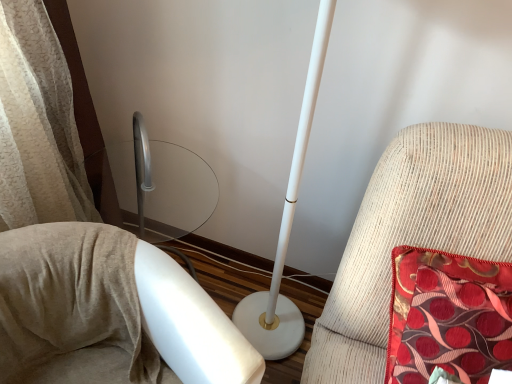
Question: Is red satin cushion at right, positioned as the 2th furniture in left-to-right order, taller or shorter than white glossy floor lamp at center, the 2th furniture positioned from the right?

Choices:
 (A) tall
 (B) short

Answer: (B)

Question: From the image's perspective, is red satin cushion at right, positioned as the 2th furniture in left-to-right order, located above or below white glossy floor lamp at center, which is the 1th furniture from left to right?

Choices:
 (A) above
 (B) below

Answer: (A)

Question: Looking at their shapes, would you say red satin cushion at right, positioned as the 2th furniture in left-to-right order, is wider or thinner than white glossy floor lamp at center, which is the 1th furniture from left to right?

Choices:
 (A) wide
 (B) thin

Answer: (B)

Question: Visually, is white glossy floor lamp at center, the 2th furniture positioned from the right, positioned to the left or to the right of red satin cushion at right, which is the first furniture from right to left?

Choices:
 (A) right
 (B) left

Answer: (B)

Question: Is point (113, 332) closer or farther from the camera than point (422, 152)?

Choices:
 (A) farther
 (B) closer

Answer: (A)

Question: In terms of height, does white glossy floor lamp at center, the 2th furniture positioned from the right, look taller or shorter compared to red satin cushion at right, which is the first furniture from right to left?

Choices:
 (A) tall
 (B) short

Answer: (A)

Question: Relative to red satin cushion at right, positioned as the 2th furniture in left-to-right order, is white glossy floor lamp at center, which is the 1th furniture from left to right, in front or behind?

Choices:
 (A) front
 (B) behind

Answer: (A)